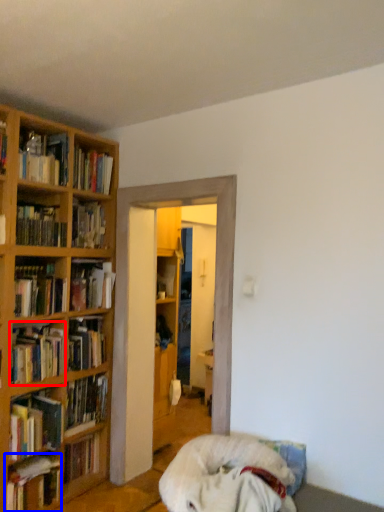
Question: Which of the following is the farthest to the observer, book (highlighted by a red box) or book (highlighted by a blue box)?

Choices:
 (A) book
 (B) book

Answer: (A)